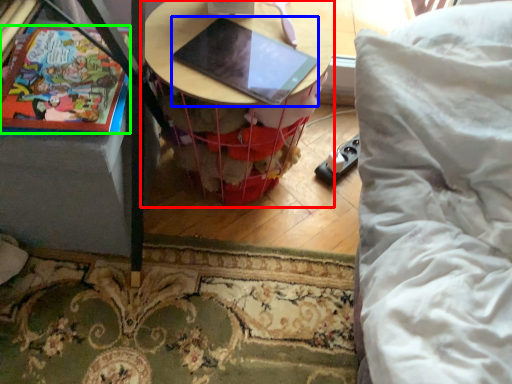
Question: Which is nearer to the table (highlighted by a red box)? laptop (highlighted by a blue box) or comic book (highlighted by a green box).

Choices:
 (A) laptop
 (B) comic book

Answer: (A)